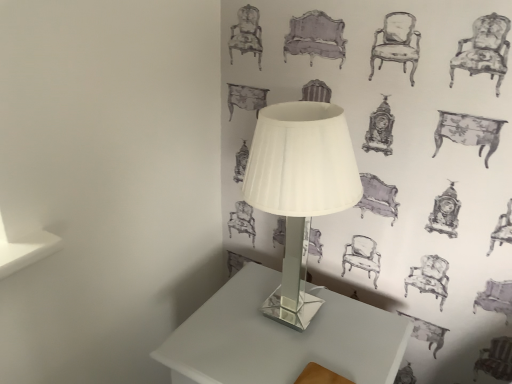
Question: Is white glossy table at center with white glass lamp at center?

Choices:
 (A) yes
 (B) no

Answer: (B)

Question: Is white glossy table at center not close to white glass lamp at center?

Choices:
 (A) no
 (B) yes

Answer: (A)

Question: Is white glossy table at center looking in the opposite direction of white glass lamp at center?

Choices:
 (A) yes
 (B) no

Answer: (B)

Question: Is white glossy table at center to the left of white glass lamp at center from the viewer's perspective?

Choices:
 (A) no
 (B) yes

Answer: (B)

Question: Does white glossy table at center have a lesser height compared to white glass lamp at center?

Choices:
 (A) no
 (B) yes

Answer: (B)

Question: From the image's perspective, does white glossy table at center appear higher than white glass lamp at center?

Choices:
 (A) no
 (B) yes

Answer: (A)

Question: Is white glass lamp at center aimed at white glossy table at center?

Choices:
 (A) yes
 (B) no

Answer: (B)

Question: Is white glass lamp at center turned away from white glossy table at center?

Choices:
 (A) yes
 (B) no

Answer: (B)

Question: From a real-world perspective, is white glass lamp at center on white glossy table at center?

Choices:
 (A) no
 (B) yes

Answer: (B)

Question: From the image's perspective, is white glass lamp at center below white glossy table at center?

Choices:
 (A) no
 (B) yes

Answer: (A)

Question: Is white glass lamp at center in front of white glossy table at center?

Choices:
 (A) no
 (B) yes

Answer: (B)

Question: From a real-world perspective, is white glass lamp at center physically below white glossy table at center?

Choices:
 (A) yes
 (B) no

Answer: (B)

Question: Considering the positions of white glossy table at center and white glass lamp at center in the image, is white glossy table at center wider or thinner than white glass lamp at center?

Choices:
 (A) thin
 (B) wide

Answer: (B)